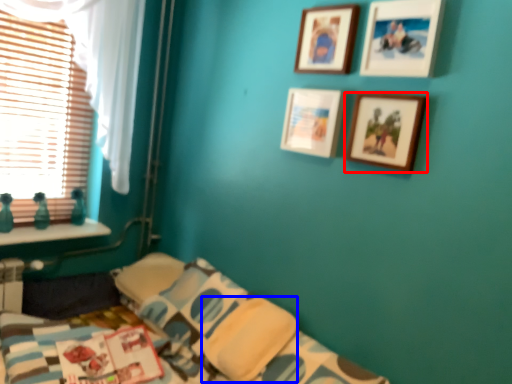
Question: Which of the following is the closest to the observer, picture frame (highlighted by a red box) or pillow (highlighted by a blue box)?

Choices:
 (A) picture frame
 (B) pillow

Answer: (A)